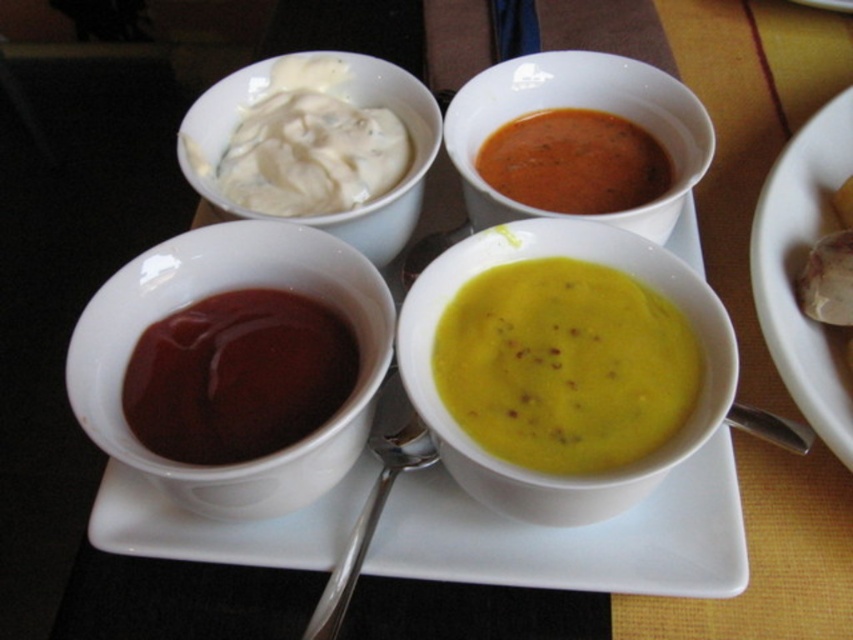
You are setting up a dining table and need to place the matte ceramic soup bowl at upper center and the smooth tomato soup at center. Which object should you place first to ensure stability?

You should place the matte ceramic soup bowl at upper center first because it is taller than the smooth tomato soup at center, providing a stable base.

Consider the image. You are holding a spoon that is 8 inches long. You want to reach the point at coordinates point [775,266] on the tray to get some sauce. Can your spoon reach that point from where you are standing?

The point point [775,266] and viewer are 23.16 inches apart. Since the spoon is only 8 inches long, it cannot reach the point point [775,266] which is 23.16 inches away.

You are a delivery robot that needs to pick up the matte white bowl at upper right. According to the coordinates provided, where exactly should you move to locate it?

The matte white bowl at upper right is located at point (x=799, y=272).